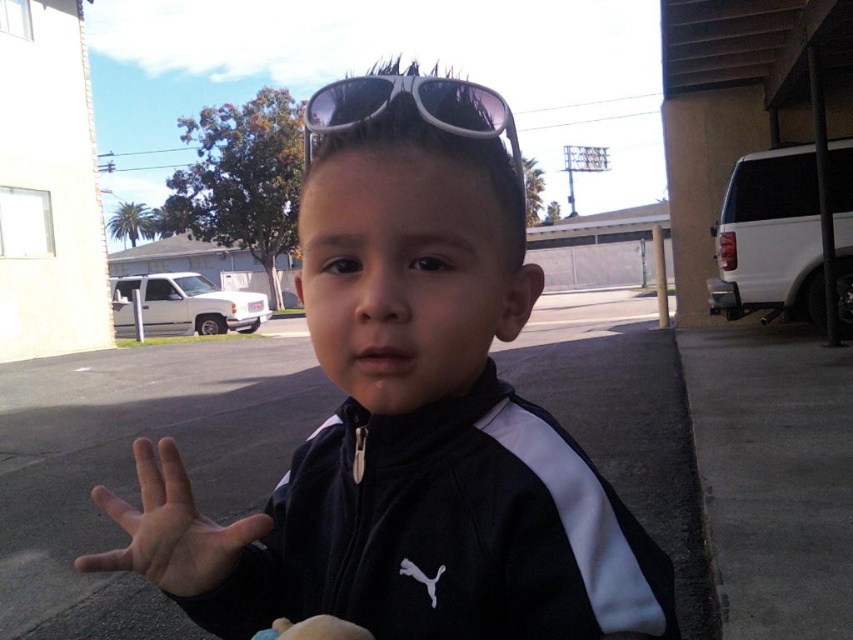
The child is wearing a black tracksuit and has a hand visible. Based on the scene, is the black matte jacket at center located to the left or right of the smooth skin hand at center?

The black matte jacket at center is to the right of the smooth skin hand at center.

Looking at this image, you are a photographer trying to capture a closeup shot of the sunglasses at center and the white matte hand at center. Which object should you focus on first to ensure it is in sharp focus?

The sunglasses at center is further to the viewer than the white matte hand at center, so you should focus on the sunglasses at center first to ensure it is in sharp focus.

The child in the scene is holding an object in their hand. Which object is closer to the child? The sunglasses at center or the white matte hand at center?

The white matte hand at center is closer to the child because it is at the same position as the hand, while the sunglasses at center are placed to the right of the hand.